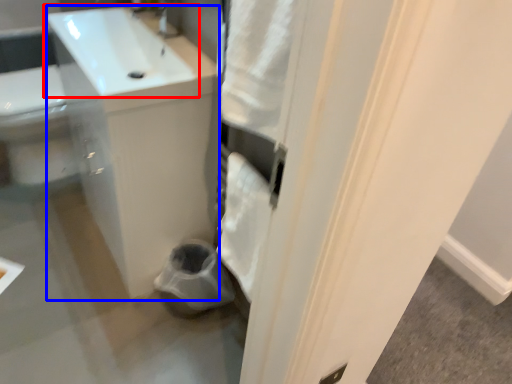
Question: Which of the following is the farthest to the observer, sink (highlighted by a red box) or counter top (highlighted by a blue box)?

Choices:
 (A) sink
 (B) counter top

Answer: (B)